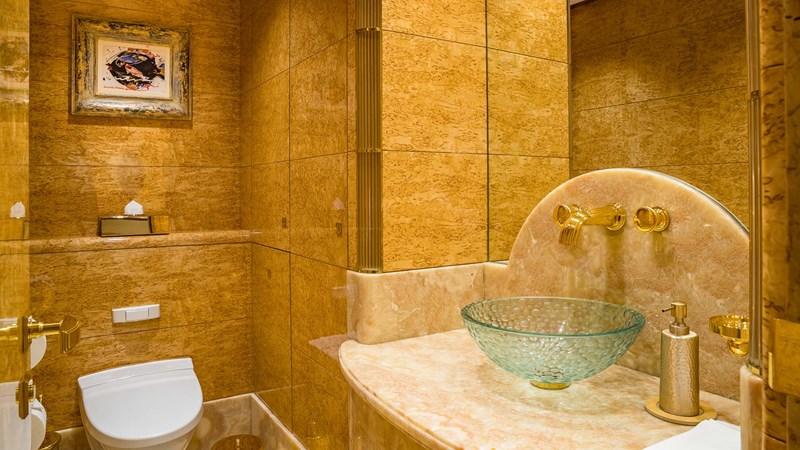
This screenshot has width=800, height=450. In order to click on soap dispenser in this screenshot , I will do `click(674, 358)`.